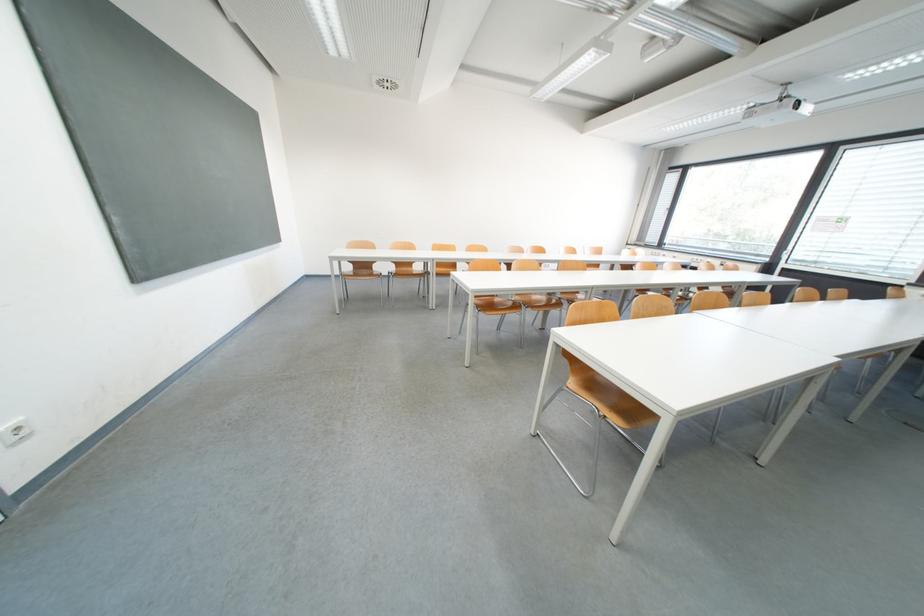
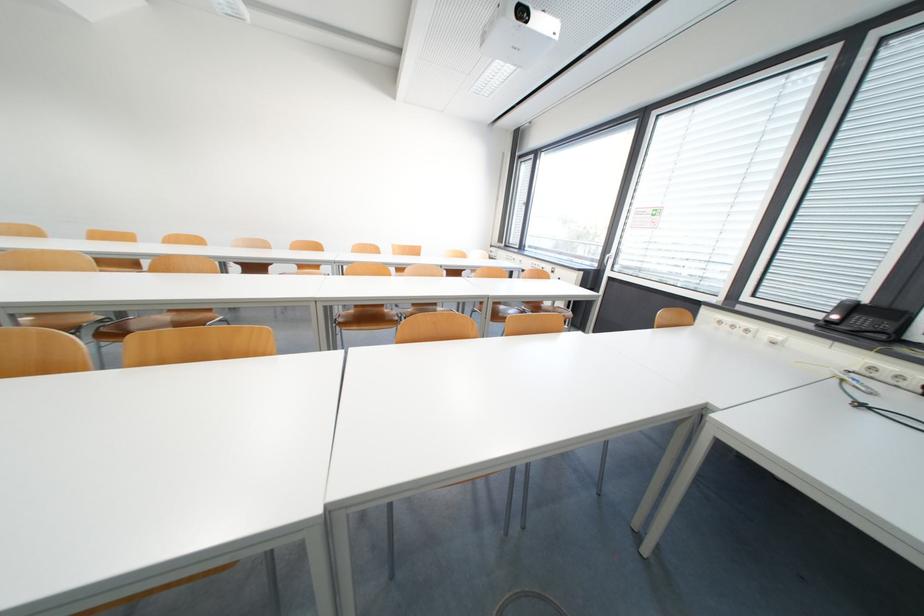
Question: The images are taken continuously from a first-person perspective. In which direction are you moving?

Choices:
 (A) Left
 (B) Right
 (C) Forward
 (D) Backward

Answer: (B)